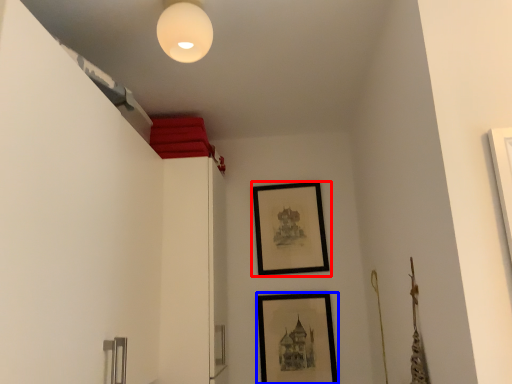
Question: Which object appears closest to the camera in this image, picture frame (highlighted by a red box) or picture frame (highlighted by a blue box)?

Choices:
 (A) picture frame
 (B) picture frame

Answer: (B)